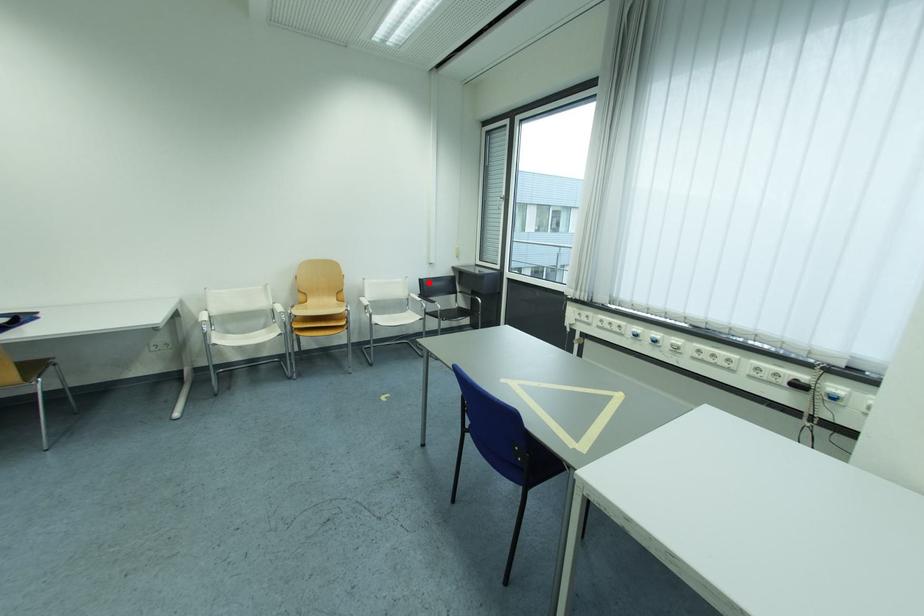
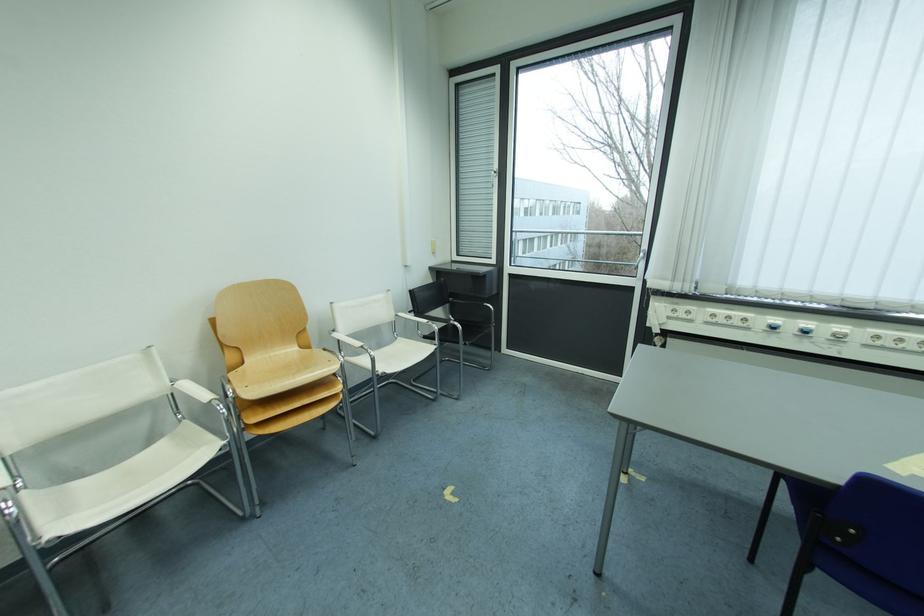
The point at the highlighted location is marked in the first image. Where is the corresponding point in the second image?

(419, 294)